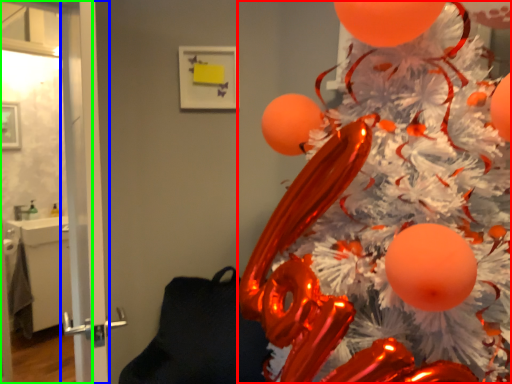
Question: Which is nearer to the christmas tree (highlighted by a red box)? screen door (highlighted by a blue box) or screen door (highlighted by a green box).

Choices:
 (A) screen door
 (B) screen door

Answer: (B)